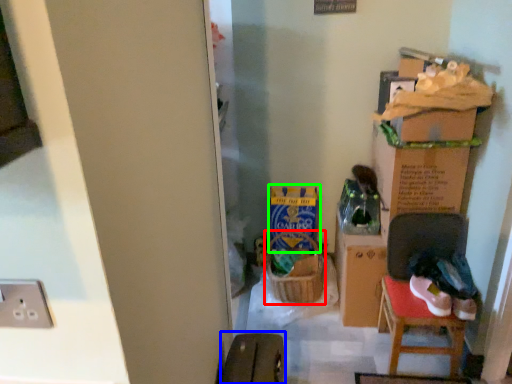
Question: Estimate the real-world distances between objects in this image. Which object is closer to laundry basket (highlighted by a red box), armchair (highlighted by a blue box) or cardboard box (highlighted by a green box)?

Choices:
 (A) armchair
 (B) cardboard box

Answer: (B)